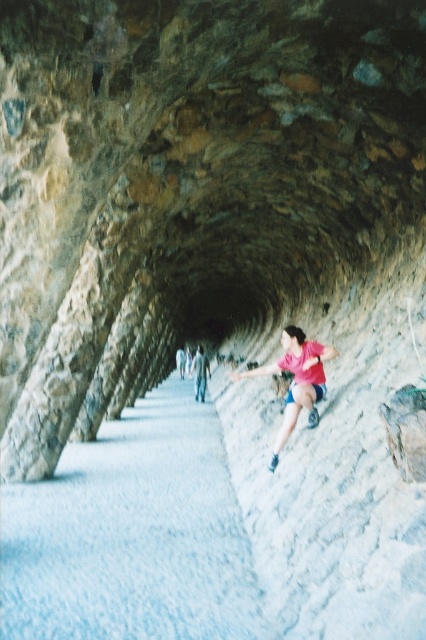
Looking at this image, is pink fabric shorts at center above pink fabric at center?

Yes, pink fabric shorts at center is above pink fabric at center.

Who is positioned more to the right, pink fabric shorts at center or pink fabric at center?

From the viewer's perspective, pink fabric shorts at center appears more on the right side.

Is point (322, 392) closer to camera compared to point (196, 364)?

Yes.

The height and width of the screenshot is (640, 426). What are the coordinates of `pink fabric shorts at center` in the screenshot? It's located at (296, 380).